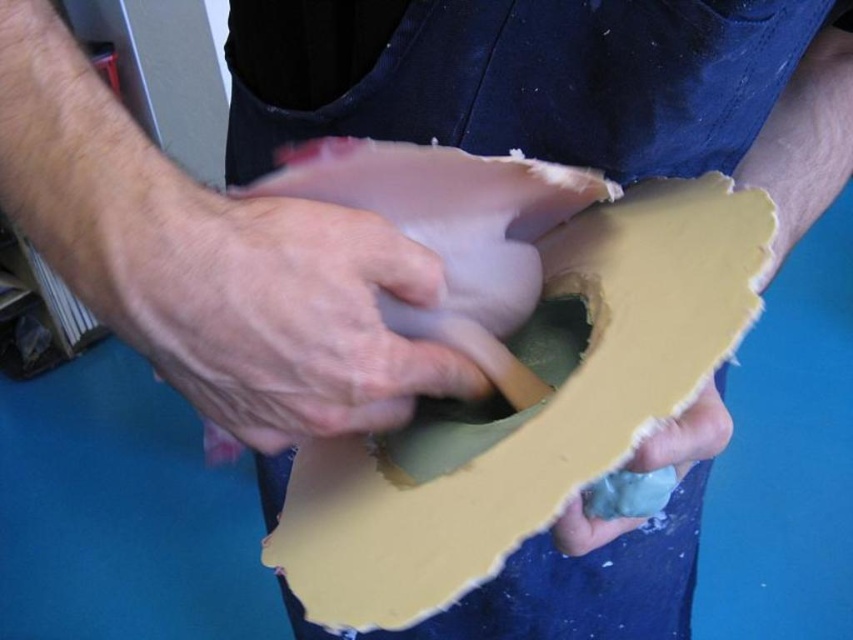
Is matte yellow cardboard at center smaller than matte yellow foam at lower center?

Incorrect, matte yellow cardboard at center is not smaller in size than matte yellow foam at lower center.

Who is more forward, (451, 573) or (688, 449)?

Point (451, 573)

Is point (401, 602) more distant than point (561, 536)?

No, it is in front of (561, 536).

Locate an element on the screen. This screenshot has width=853, height=640. matte yellow cardboard at center is located at coordinates pyautogui.click(x=529, y=410).

Consider the image. Can you confirm if dry matte skin at center is positioned to the right of matte yellow foam at lower center?

No, dry matte skin at center is not to the right of matte yellow foam at lower center.

Is dry matte skin at center wider than matte yellow foam at lower center?

Yes.

Who is more forward, (349, 291) or (560, 529)?

Point (349, 291) is more forward.

The width and height of the screenshot is (853, 640). Find the location of `dry matte skin at center`. dry matte skin at center is located at coordinates (287, 316).

Does point (392, 484) come in front of point (387, 241)?

No.

Locate an element on the screen. Image resolution: width=853 pixels, height=640 pixels. matte yellow cardboard at center is located at coordinates (529, 410).